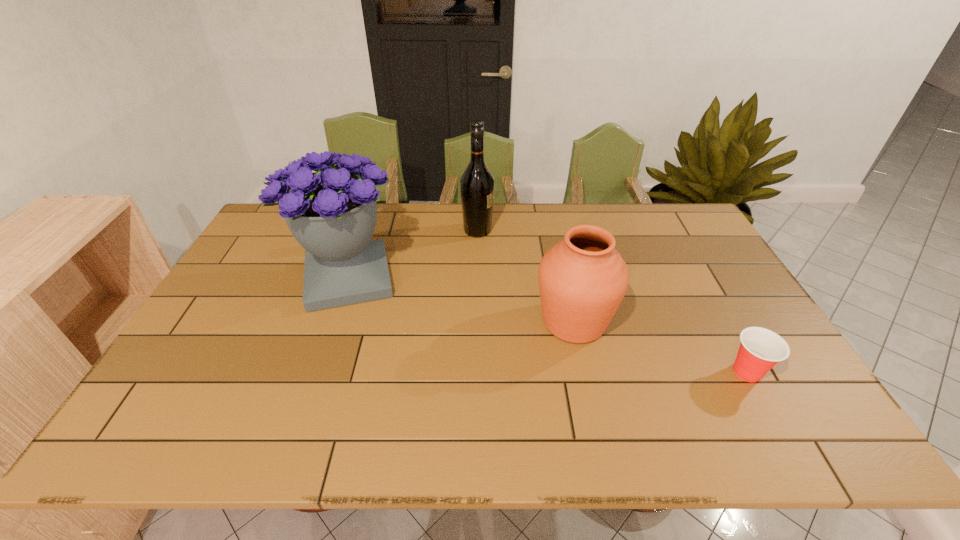
Locate an element on the screen. The height and width of the screenshot is (540, 960). the leftmost object is located at coordinates (332, 213).

In order to click on the third object from right to left in this screenshot , I will do `click(477, 183)`.

Find the location of a particular element. The image size is (960, 540). wine bottle is located at coordinates (477, 183).

I want to click on urn, so click(x=583, y=279).

The height and width of the screenshot is (540, 960). I want to click on the second object from right to left, so click(x=583, y=279).

You are a GUI agent. You are given a task and a screenshot of the screen. Output one action in this format:
    pyautogui.click(x=<x>, y=<y>)
    Task: Click on the rightmost object
    Image resolution: width=960 pixels, height=540 pixels.
    Given the screenshot: What is the action you would take?
    pyautogui.click(x=760, y=350)

This screenshot has height=540, width=960. What are the coordinates of `cup` in the screenshot? It's located at click(760, 350).

Find the location of a particular element. Image resolution: width=960 pixels, height=540 pixels. free space located on the back of the leftmost object is located at coordinates (373, 206).

Where is `free space located 0.380m on the label of the second object from left to right`? This screenshot has width=960, height=540. free space located 0.380m on the label of the second object from left to right is located at coordinates (603, 231).

I want to click on vacant region located 0.150m on the back of the third object from left to right, so click(x=561, y=262).